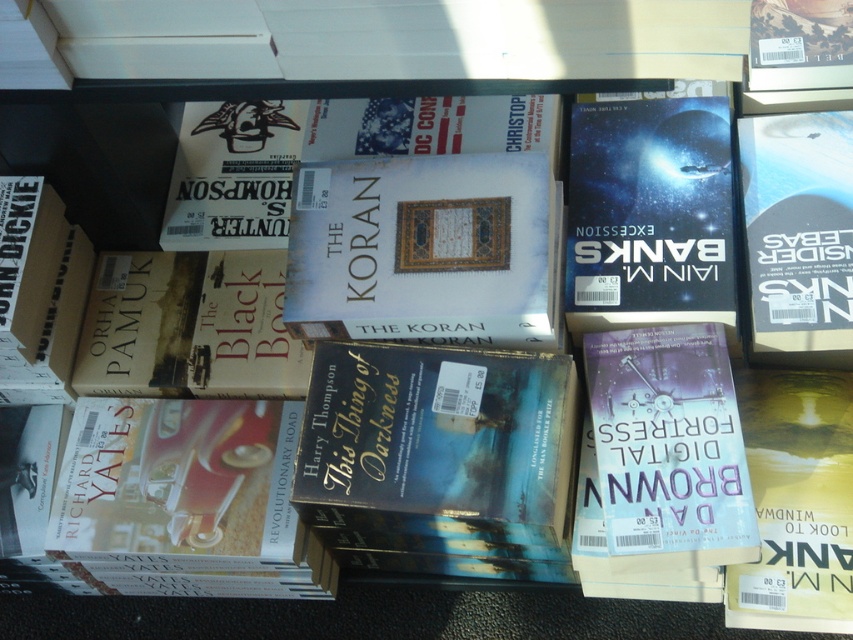
Is white matte book at center taller than hardcover book at right?

No, white matte book at center is not taller than hardcover book at right.

Can you confirm if white matte book at center is smaller than hardcover book at right?

Actually, white matte book at center might be larger than hardcover book at right.

The image size is (853, 640). Find the location of `white matte book at center`. white matte book at center is located at coordinates (424, 250).

Is blue matte book at center below hardcover book at right?

Yes.

Does point (421, 356) come behind point (819, 163)?

No.

Is point (494, 360) positioned after point (805, 221)?

No.

Find the location of a particular element. blue matte book at center is located at coordinates (437, 442).

Is point (457, 404) closer to camera compared to point (398, 164)?

Yes, it is.

Is blue matte book at center closer to the viewer compared to white matte book at center?

Yes, blue matte book at center is in front of white matte book at center.

Does point (517, 358) come in front of point (427, 157)?

Yes.

The width and height of the screenshot is (853, 640). What are the coordinates of `blue matte book at center` in the screenshot? It's located at pyautogui.click(x=437, y=442).